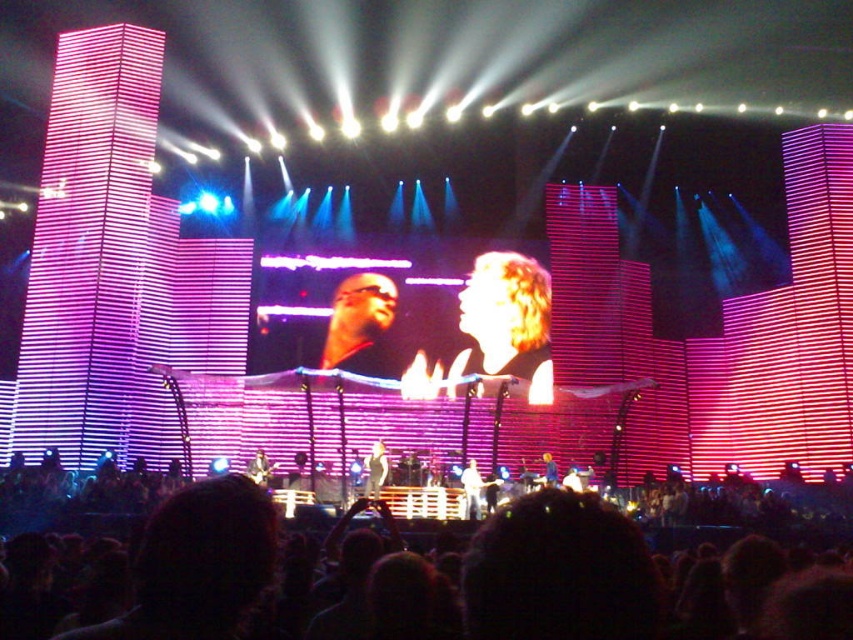
Question: Can you confirm if white glossy microphone at center is positioned above smooth skin face at center?

Choices:
 (A) no
 (B) yes

Answer: (B)

Question: Where is white glossy microphone at center located in relation to smooth skin face at center in the image?

Choices:
 (A) right
 (B) left

Answer: (B)

Question: Which object is closer to the camera taking this photo?

Choices:
 (A) smooth skin face at center
 (B) matte black glasses at center
 (C) blonde hair at center

Answer: (A)

Question: Which object is positioned closest to the blonde hair at center?

Choices:
 (A) smooth skin face at center
 (B) matte black glasses at center
 (C) white glossy microphone at center

Answer: (B)

Question: Which object is positioned farthest from the white glossy microphone at center?

Choices:
 (A) smooth skin face at center
 (B) blonde hair at center

Answer: (B)

Question: Is matte black glasses at center to the left of white glossy microphone at center from the viewer's perspective?

Choices:
 (A) no
 (B) yes

Answer: (B)